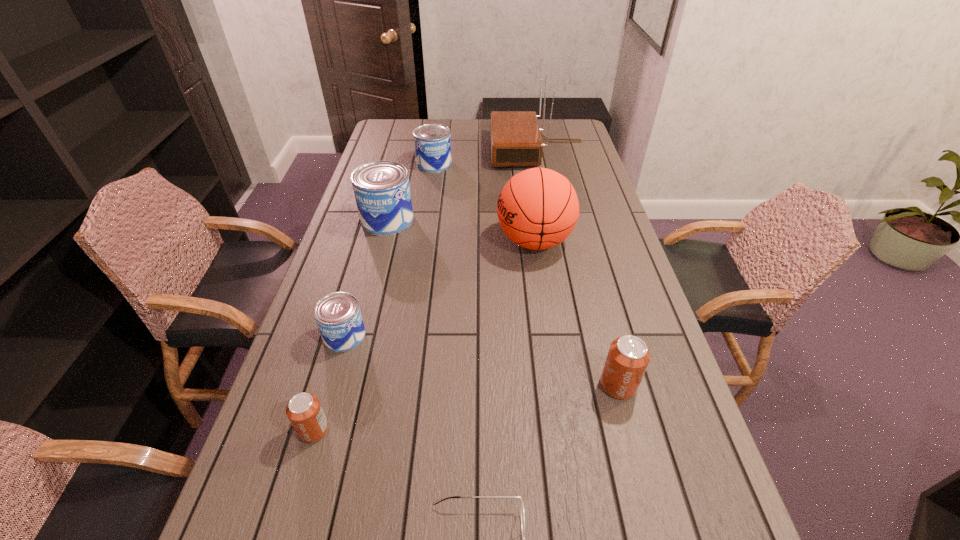
Identify which object is the sixth closest to the second tallest object. Please provide its 2D coordinates. Your answer should be formatted as a tuple, i.e. [(x, y)], where the tuple contains the x and y coordinates of a point satisfying the conditions above.

[(304, 411)]

Find the location of a particular element. The image size is (960, 540). can that is the nearest to the nearest blue can is located at coordinates (304, 411).

Select which can appears as the second closest to the second nearest blue can. Please provide its 2D coordinates. Your answer should be formatted as a tuple, i.e. [(x, y)], where the tuple contains the x and y coordinates of a point satisfying the conditions above.

[(338, 317)]

Locate an element on the screen. The width and height of the screenshot is (960, 540). blue can that is the third closest to the nearest object is located at coordinates (432, 142).

Select which blue can appears as the third closest to the nearest object. Please provide its 2D coordinates. Your answer should be formatted as a tuple, i.e. [(x, y)], where the tuple contains the x and y coordinates of a point satisfying the conditions above.

[(432, 142)]

Locate an element on the screen. The image size is (960, 540). free space in the image that satisfies the following two spatial constraints: 1. on the front panel of the radio_receiver; 2. on the right side of the bigger orange can is located at coordinates (586, 385).

Find the location of a particular element. blank area in the image that satisfies the following two spatial constraints: 1. on the side with logo of the second tallest object; 2. on the left side of the rightmost can is located at coordinates (555, 385).

In order to click on vacant point that satisfies the following two spatial constraints: 1. on the front panel of the tallest object; 2. on the left side of the rightmost can in this screenshot , I will do `click(586, 385)`.

Identify the location of free space in the image that satisfies the following two spatial constraints: 1. on the front panel of the bigger orange can; 2. on the right side of the radio_receiver. The image size is (960, 540). (586, 385).

The image size is (960, 540). What are the coordinates of `free spot that satisfies the following two spatial constraints: 1. on the back side of the second nearest can; 2. on the front label of the fifth farthest object` in the screenshot? It's located at (605, 336).